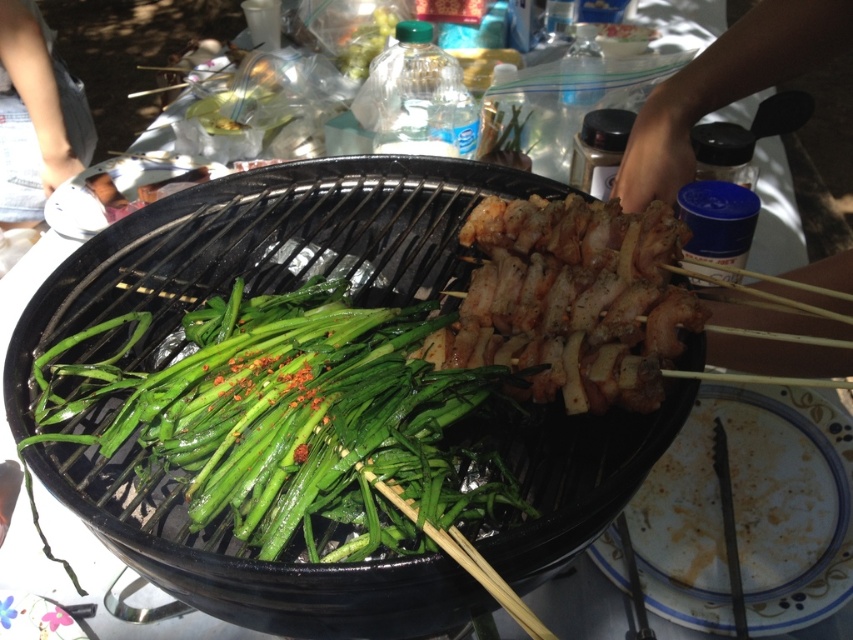
How much distance is there between grilled meat at center and white matte phone at upper left?

The distance of grilled meat at center from white matte phone at upper left is 4.25 feet.

Which of these two, grilled meat at center or white matte phone at upper left, stands shorter?

With less height is grilled meat at center.

Which is in front, point (492, 204) or point (22, 180)?

Point (492, 204) is more forward.

The height and width of the screenshot is (640, 853). I want to click on grilled meat at center, so click(x=572, y=300).

Between green glossy vegetables at center and white matte phone at upper left, which one is positioned higher?

white matte phone at upper left is higher up.

Image resolution: width=853 pixels, height=640 pixels. What do you see at coordinates (289, 417) in the screenshot?
I see `green glossy vegetables at center` at bounding box center [289, 417].

Who is more distant from viewer, (294, 292) or (7, 42)?

Point (7, 42)

This screenshot has width=853, height=640. What are the coordinates of `green glossy vegetables at center` in the screenshot? It's located at (289, 417).

Who is taller, green glossy vegetables at center or grilled meat at center?

Standing taller between the two is green glossy vegetables at center.

Does point (448, 385) lie behind point (538, 316)?

That is False.

Who is more distant from viewer, (375, 544) or (573, 408)?

Point (573, 408)

Where is `green glossy vegetables at center`? green glossy vegetables at center is located at coordinates (289, 417).